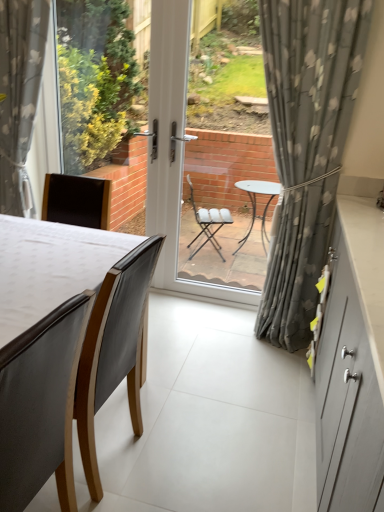
Locate an element on the screen. This screenshot has width=384, height=512. vacant space underneath gray floral curtain at center, placed as the second curtain when sorted from left to right (from a real-world perspective) is located at coordinates (240, 332).